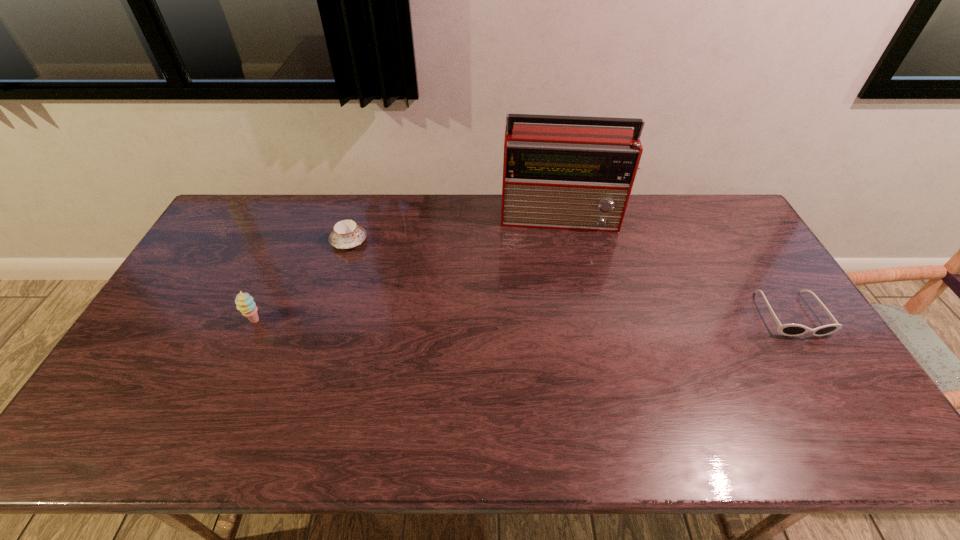
Identify the location of free space between the third object from left to right and the sherbert. The height and width of the screenshot is (540, 960). (408, 269).

Find the location of a particular element. The width and height of the screenshot is (960, 540). vacant point located between the second shortest object and the shortest object is located at coordinates (570, 278).

At what (x,y) coordinates should I click in order to perform the action: click on free spot between the rightmost object and the second tallest object. Please return your answer as a coordinate pair (x, y). The image size is (960, 540). Looking at the image, I should click on (523, 318).

Locate an element on the screen. This screenshot has height=540, width=960. vacant region between the second object from left to right and the rightmost object is located at coordinates (570, 278).

Locate which object is the third closest to the sunglasses. Please provide its 2D coordinates. Your answer should be formatted as a tuple, i.e. [(x, y)], where the tuple contains the x and y coordinates of a point satisfying the conditions above.

[(244, 302)]

Point out which object is positioned as the third nearest to the teacup. Please provide its 2D coordinates. Your answer should be formatted as a tuple, i.e. [(x, y)], where the tuple contains the x and y coordinates of a point satisfying the conditions above.

[(787, 329)]

The height and width of the screenshot is (540, 960). I want to click on vacant position in the image that satisfies the following two spatial constraints: 1. on the back side of the teacup; 2. on the right side of the sherbert, so click(291, 241).